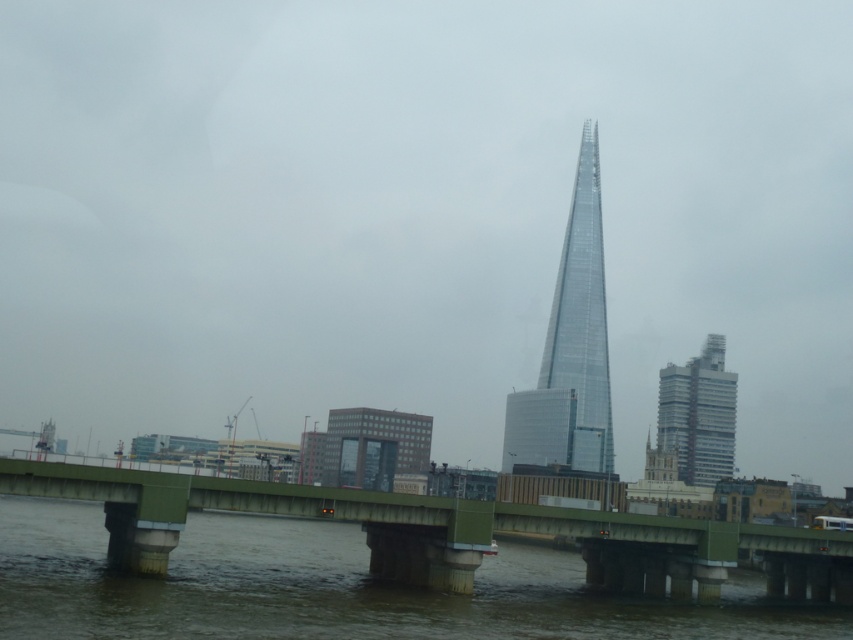
Does transparent glass tower at center have a greater height compared to glassy steel skyscraper at right?

Correct, transparent glass tower at center is much taller as glassy steel skyscraper at right.

Does transparent glass tower at center come in front of glassy steel skyscraper at right?

No, transparent glass tower at center is behind glassy steel skyscraper at right.

Where is `transparent glass tower at center`? The image size is (853, 640). transparent glass tower at center is located at coordinates (570, 346).

Where is `transparent glass tower at center`? transparent glass tower at center is located at coordinates (570, 346).

Who is taller, green concrete bridge at center or transparent glass tower at center?

transparent glass tower at center

Is green concrete bridge at center in front of transparent glass tower at center?

That is True.

Is point (468, 540) in front of point (576, 339)?

Yes, point (468, 540) is in front of point (576, 339).

Identify the location of green concrete bridge at center. Image resolution: width=853 pixels, height=640 pixels. (450, 532).

Is green concrete bridge at center smaller than glassy steel skyscraper at right?

Yes.

Is point (521, 506) closer to camera compared to point (703, 387)?

Yes, it is in front of point (703, 387).

Who is more forward, (614, 518) or (677, 467)?

Point (614, 518) is in front.

At what (x,y) coordinates should I click in order to perform the action: click on green concrete bridge at center. Please return your answer as a coordinate pair (x, y). This screenshot has width=853, height=640. Looking at the image, I should click on (450, 532).